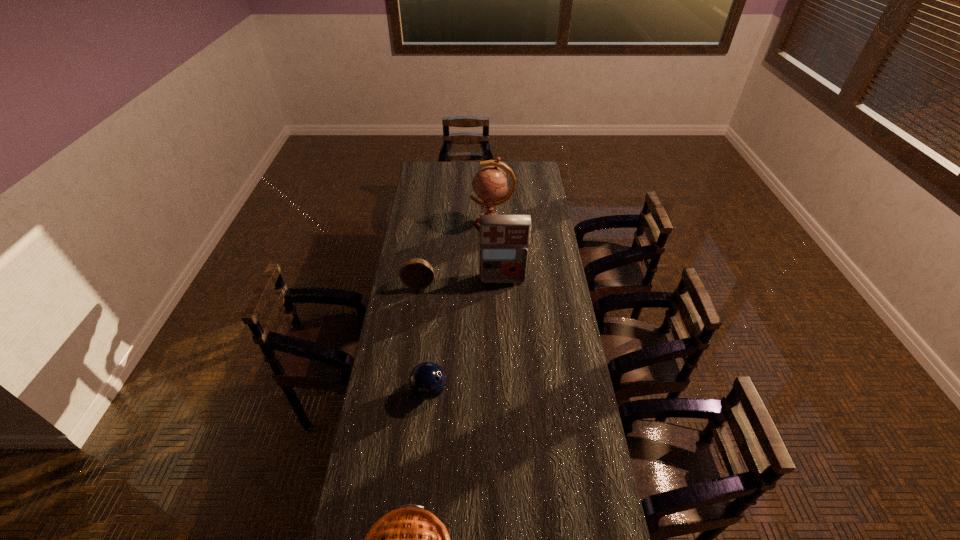
Identify the location of globe. The width and height of the screenshot is (960, 540). (490, 184).

Image resolution: width=960 pixels, height=540 pixels. Find the location of `the first-aid kit`. the first-aid kit is located at coordinates (504, 239).

Where is `the third shortest object`? Image resolution: width=960 pixels, height=540 pixels. the third shortest object is located at coordinates (416, 273).

This screenshot has height=540, width=960. What are the coordinates of `the fourth farthest object` in the screenshot? It's located at (427, 380).

Where is `the fourth tallest object`? The image size is (960, 540). the fourth tallest object is located at coordinates (427, 380).

Where is `vacant space located on the front-facing side of the farthest object`? vacant space located on the front-facing side of the farthest object is located at coordinates coord(422,224).

You are a GUI agent. You are given a task and a screenshot of the screen. Output one action in this format:
    pyautogui.click(x=<x>, y=<y>)
    Task: Click on the vacant position located on the front-facing side of the farthest object
    The height and width of the screenshot is (540, 960).
    Given the screenshot: What is the action you would take?
    pyautogui.click(x=415, y=224)

Where is `vacant space located 0.050m on the front-facing side of the farthest object`? Image resolution: width=960 pixels, height=540 pixels. vacant space located 0.050m on the front-facing side of the farthest object is located at coordinates (461, 224).

Identify the location of free spot located on the front-facing side of the fourth shortest object. (505, 321).

This screenshot has height=540, width=960. Find the location of `vacant point located on the right of the third shortest object`. vacant point located on the right of the third shortest object is located at coordinates (461, 284).